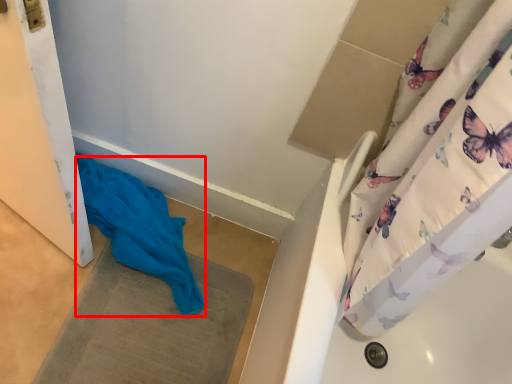
Question: From the image's perspective, what is the correct spatial relationship of fabric (annotated by the red box) in relation to bath mat?

Choices:
 (A) above
 (B) below

Answer: (A)